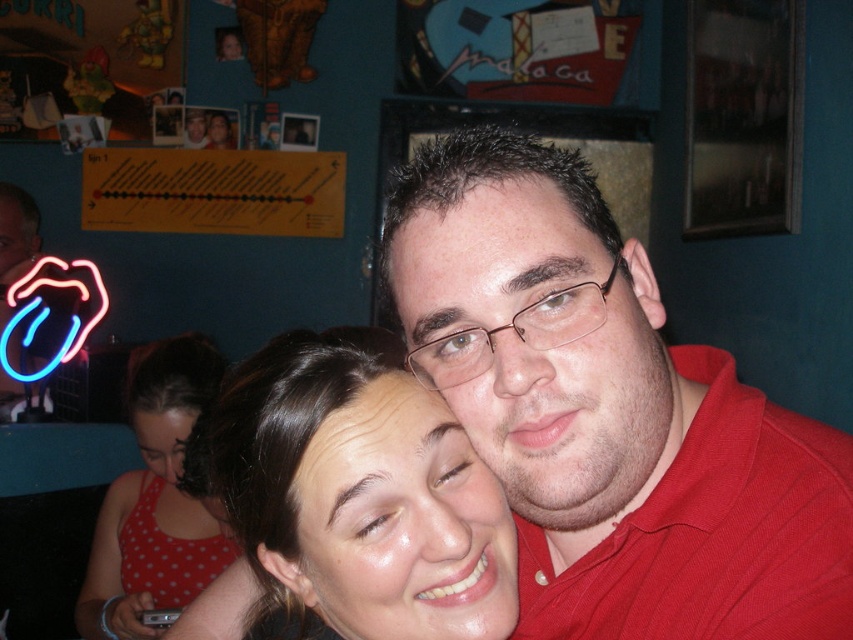
Question: Does smooth skin face at center appear on the left side of neon blue tongue at left?

Choices:
 (A) no
 (B) yes

Answer: (A)

Question: Which object is positioned closest to the polka dot fabric dress at lower left?

Choices:
 (A) matte red shirt at center
 (B) neon blue tongue at left
 (C) smooth skin face at center

Answer: (C)

Question: Which object is the farthest from the smooth skin face at center?

Choices:
 (A) polka dot fabric dress at lower left
 (B) neon blue tongue at left

Answer: (B)

Question: Can you confirm if smooth skin face at center is positioned below polka dot fabric dress at lower left?

Choices:
 (A) no
 (B) yes

Answer: (A)

Question: Among these points, which one is nearest to the camera?

Choices:
 (A) click(x=357, y=595)
 (B) click(x=213, y=371)
 (C) click(x=550, y=525)

Answer: (A)

Question: Is smooth skin face at center to the right of polka dot fabric dress at lower left from the viewer's perspective?

Choices:
 (A) no
 (B) yes

Answer: (B)